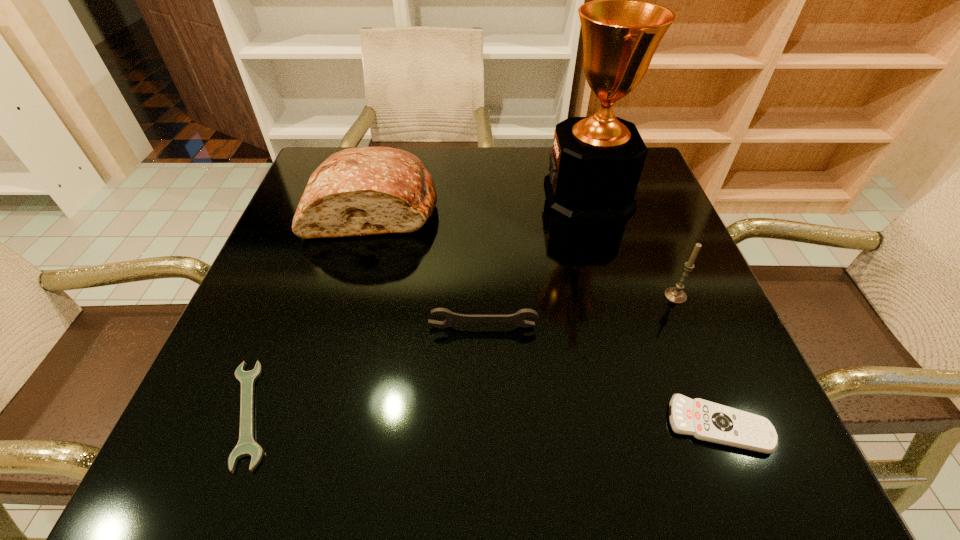
Where is `trophy cup`? The width and height of the screenshot is (960, 540). trophy cup is located at coordinates (596, 162).

Where is `bread`? The height and width of the screenshot is (540, 960). bread is located at coordinates (359, 191).

Locate an element on the screen. The width and height of the screenshot is (960, 540). candle is located at coordinates (675, 294).

Identify the location of the fourth farthest object. (452, 318).

Where is `the taller wrench`? The height and width of the screenshot is (540, 960). the taller wrench is located at coordinates (452, 318).

You are a GUI agent. You are given a task and a screenshot of the screen. Output one action in this format:
    pyautogui.click(x=<x>, y=<y>)
    Task: Click on the remote control
    This screenshot has width=960, height=540.
    Given the screenshot: What is the action you would take?
    pyautogui.click(x=704, y=420)

Where is `the nearer wrench`? the nearer wrench is located at coordinates (246, 446).

This screenshot has height=540, width=960. Identify the location of the shortest object. (246, 446).

The width and height of the screenshot is (960, 540). I want to click on blank area located 0.080m on the front of the trophy cup with the label, so click(x=514, y=195).

This screenshot has width=960, height=540. What are the coordinates of `vacant area located 0.120m on the front of the trophy cup with the label` in the screenshot? It's located at (497, 195).